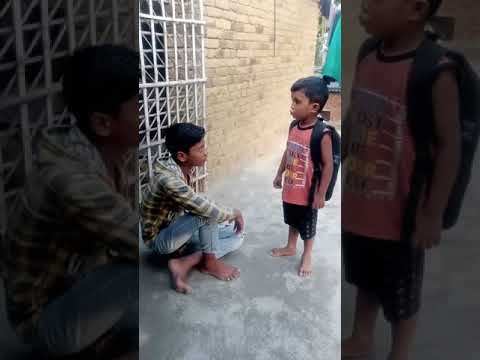
You are a GUI agent. You are given a task and a screenshot of the screen. Output one action in this format:
    pyautogui.click(x=<x>, y=<y>)
    Task: Click on the wall
    Image resolution: width=480 pixels, height=360 pixels.
    Given the screenshot: What is the action you would take?
    pyautogui.click(x=247, y=55)